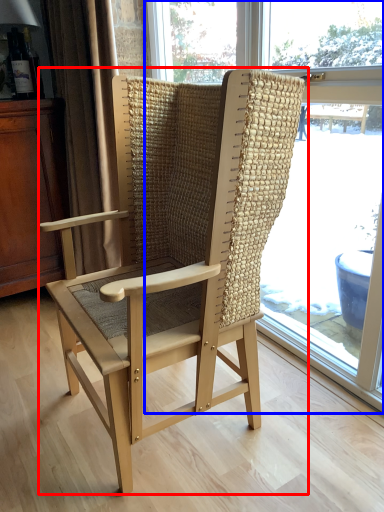
Question: Among these objects, which one is nearest to the camera, chair (highlighted by a red box) or window (highlighted by a blue box)?

Choices:
 (A) chair
 (B) window

Answer: (A)